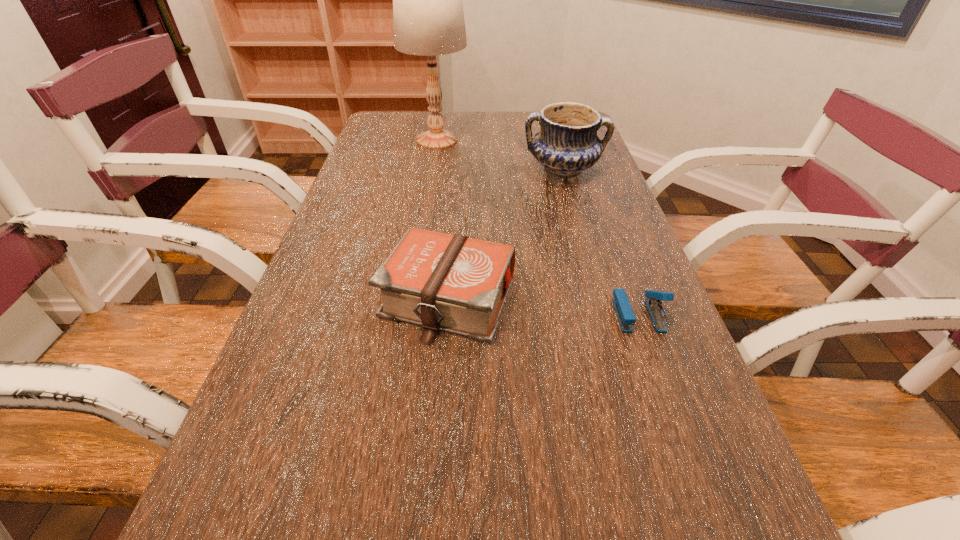
In order to click on vacant area between the pottery and the tallest object in this screenshot , I will do `click(500, 155)`.

You are a GUI agent. You are given a task and a screenshot of the screen. Output one action in this format:
    pyautogui.click(x=<x>, y=<y>)
    Task: Click on the object that stands as the second closest to the lamp
    
    Given the screenshot: What is the action you would take?
    pyautogui.click(x=453, y=283)

Identify which object is located as the nearest to the tallest object. Please provide its 2D coordinates. Your answer should be formatted as a tuple, i.e. [(x, y)], where the tuple contains the x and y coordinates of a point satisfying the conditions above.

[(567, 143)]

In order to click on free space that satisfies the following two spatial constraints: 1. on the front side of the stapler; 2. on the right side of the lamp in this screenshot , I will do `click(408, 315)`.

The image size is (960, 540). I want to click on free location that satisfies the following two spatial constraints: 1. on the front side of the third shortest object; 2. on the left side of the lamp, so click(x=432, y=170).